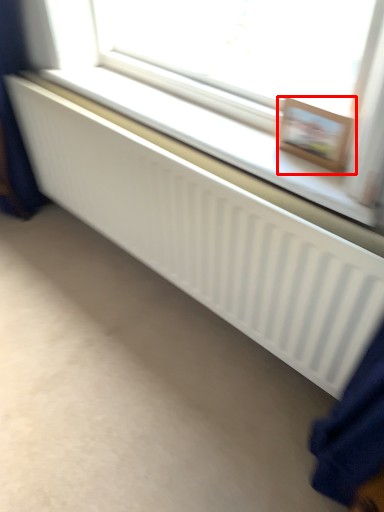
Question: From the image's perspective, where is picture frame (annotated by the red box) located relative to bay window?

Choices:
 (A) below
 (B) above

Answer: (A)